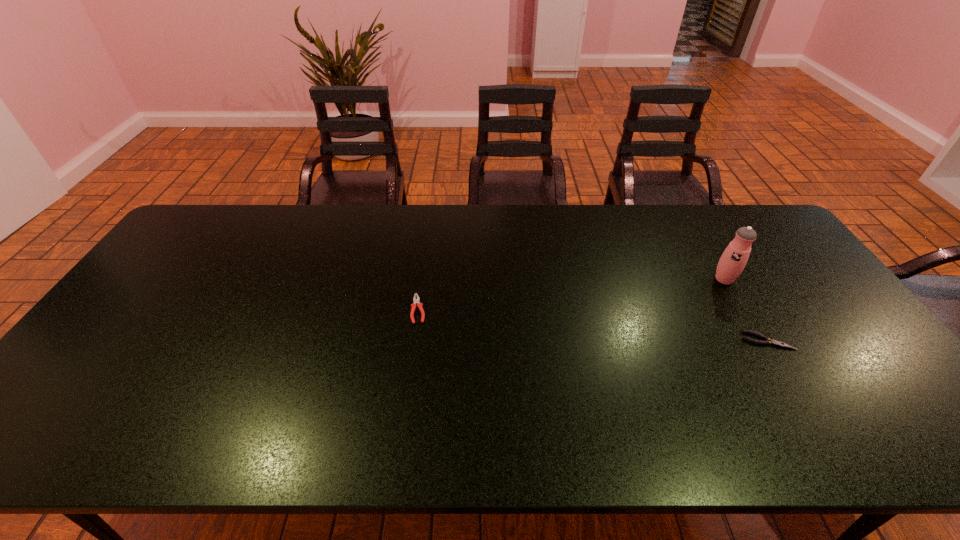
The height and width of the screenshot is (540, 960). What are the coordinates of `empty space that is in between the nearer pliers and the tallest object` in the screenshot? It's located at (746, 310).

At what (x,y) coordinates should I click in order to perform the action: click on free space between the farther pliers and the nearer pliers. Please return your answer as a coordinate pair (x, y). This screenshot has width=960, height=540. Looking at the image, I should click on (593, 325).

Select which object appears as the second closest to the second nearest object. Please provide its 2D coordinates. Your answer should be formatted as a tuple, i.e. [(x, y)], where the tuple contains the x and y coordinates of a point satisfying the conditions above.

[(733, 260)]

Locate which object is the second closest to the thermos bottle. Please provide its 2D coordinates. Your answer should be formatted as a tuple, i.e. [(x, y)], where the tuple contains the x and y coordinates of a point satisfying the conditions above.

[(415, 301)]

Identify the location of blank space that satisfies the following two spatial constraints: 1. on the back side of the thermos bottle; 2. on the right side of the second farthest object. This screenshot has width=960, height=540. (422, 280).